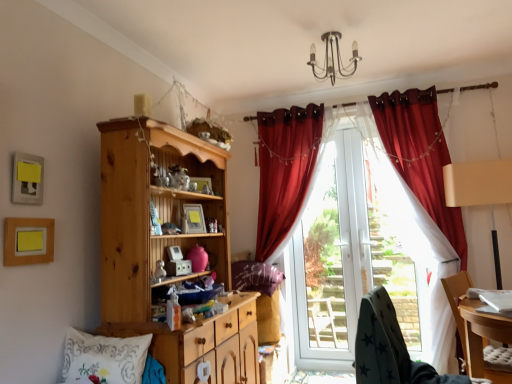
At what (x,y) coordinates should I click in order to perform the action: click on vacant space situated above metallic chandelier at upper center (from a real-world perspective). Please return your answer as a coordinate pair (x, y). The height and width of the screenshot is (384, 512). Looking at the image, I should click on (339, 29).